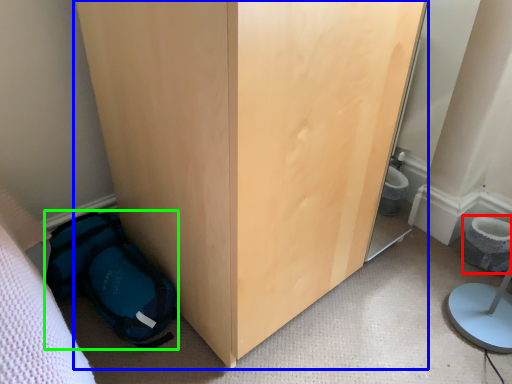
Question: Which object is positioned closest to toilet bowl (highlighted by a red box)? Select from furniture (highlighted by a blue box) and backpack (highlighted by a green box).

Choices:
 (A) furniture
 (B) backpack

Answer: (A)